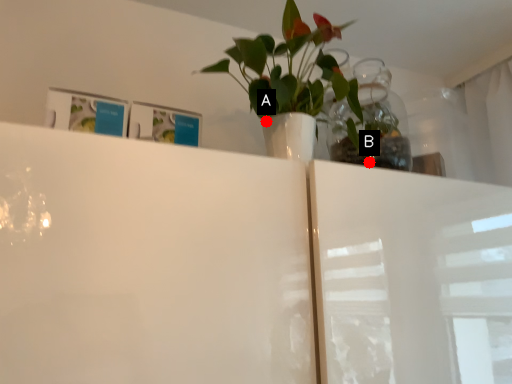
Question: Two points are circled on the image, labeled by A and B beside each circle. Which of the following is the closest to the observer?

Choices:
 (A) A is closer
 (B) B is closer

Answer: (A)